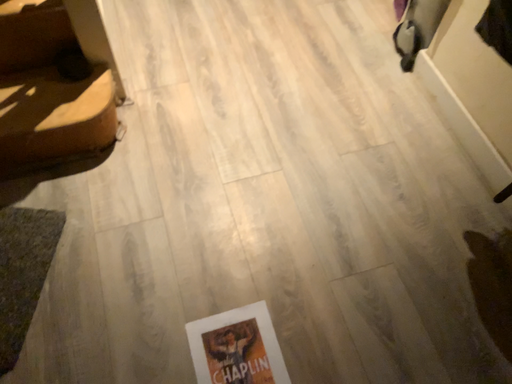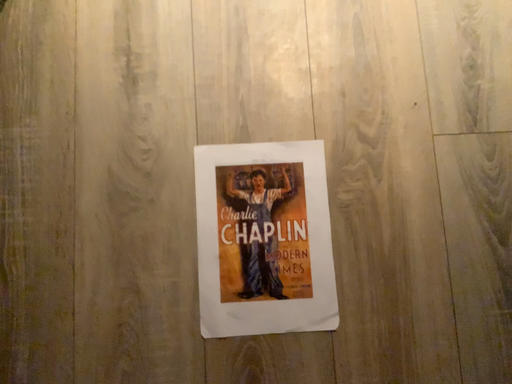
Question: How did the camera likely rotate when shooting the video?

Choices:
 (A) rotated left
 (B) rotated right

Answer: (A)